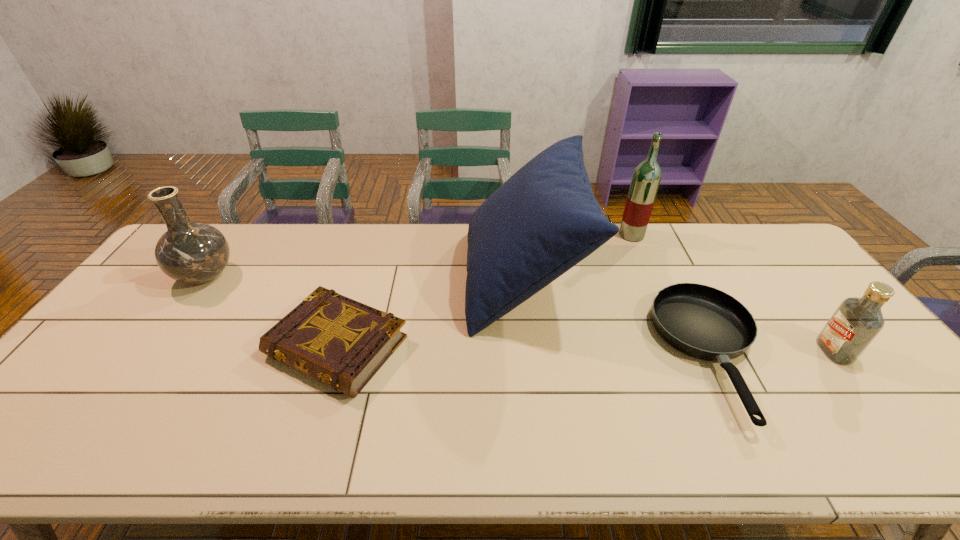
Where is `vase that is at the far edge`? The image size is (960, 540). vase that is at the far edge is located at coordinates (189, 252).

Identify the location of object at the near edge. Image resolution: width=960 pixels, height=540 pixels. (703, 322).

I want to click on object situated at the left edge, so click(189, 252).

The width and height of the screenshot is (960, 540). Identify the location of object located in the right edge section of the desktop. click(856, 322).

Locate an element on the screen. The image size is (960, 540). object positioned at the far left corner is located at coordinates (189, 252).

The width and height of the screenshot is (960, 540). What are the coordinates of `vacant area at the far edge` in the screenshot? It's located at point(300,251).

In the image, there is a desktop. Identify the location of vacant area at the near edge. (810, 449).

Find the location of a particular element. vacant space at the right edge of the desktop is located at coordinates (793, 285).

You are a GUI agent. You are given a task and a screenshot of the screen. Output one action in this format:
    pyautogui.click(x=<x>, y=<y>)
    Task: Click on the free space at the near left corner
    The image size is (960, 540).
    Given the screenshot: What is the action you would take?
    point(58,465)

This screenshot has width=960, height=540. In the image, there is a desktop. What are the coordinates of `vacant space at the far right corner` in the screenshot? It's located at (737, 233).